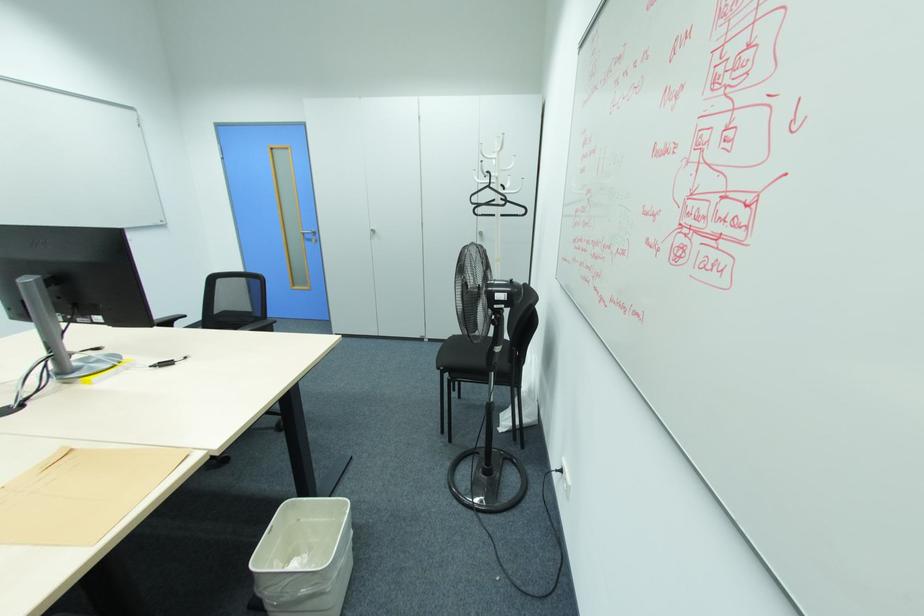
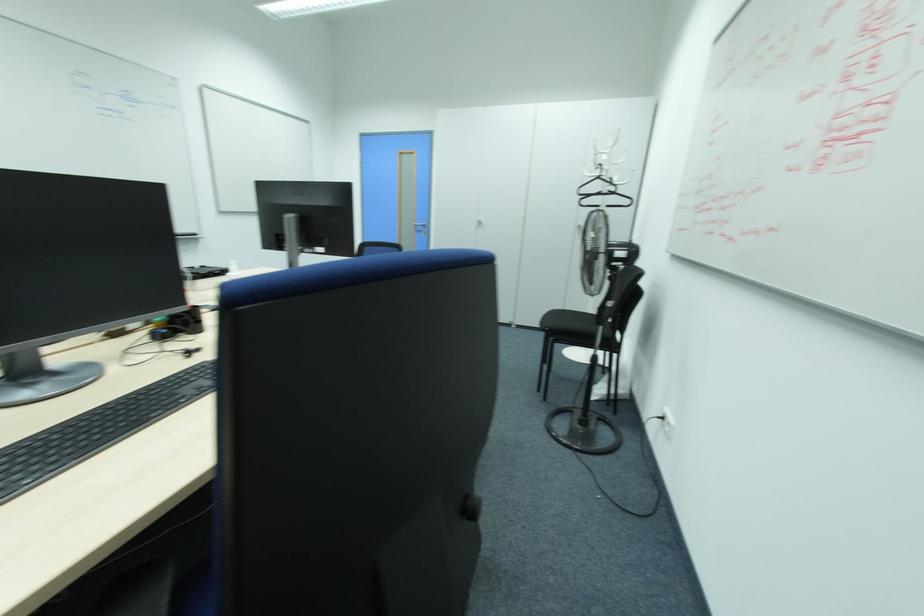
In the second image, find the point that corresponds to the point at 565,480 in the first image.

(670, 424)